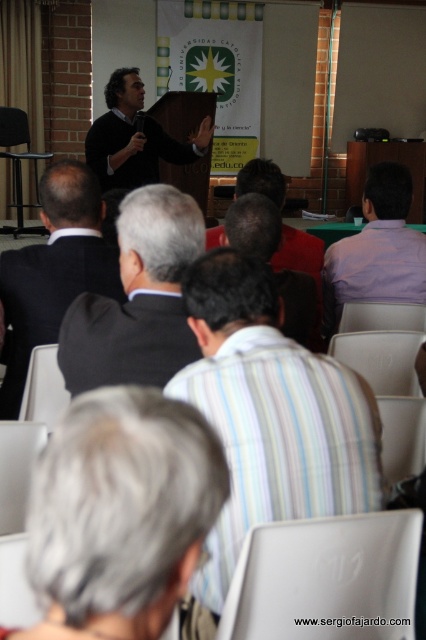
Question: Estimate the real-world distances between objects in this image. Which object is farther from the red shirt at center?

Choices:
 (A) dark gray suit at center
 (B) purple cotton shirt at center

Answer: (A)

Question: Considering the relative positions of black suit at center and purple cotton shirt at center in the image provided, where is black suit at center located with respect to purple cotton shirt at center?

Choices:
 (A) above
 (B) below

Answer: (B)

Question: Can you confirm if gray striped shirt at lower center is wider than striped cotton shirt at center?

Choices:
 (A) yes
 (B) no

Answer: (B)

Question: Does black suit at center appear under red shirt at center?

Choices:
 (A) no
 (B) yes

Answer: (B)

Question: Which point appears farthest from the camera in this image?

Choices:
 (A) pyautogui.click(x=206, y=387)
 (B) pyautogui.click(x=138, y=355)

Answer: (B)

Question: Which object is positioned farthest from the red shirt at center?

Choices:
 (A) gray striped shirt at lower center
 (B) dark gray sweater at center

Answer: (B)